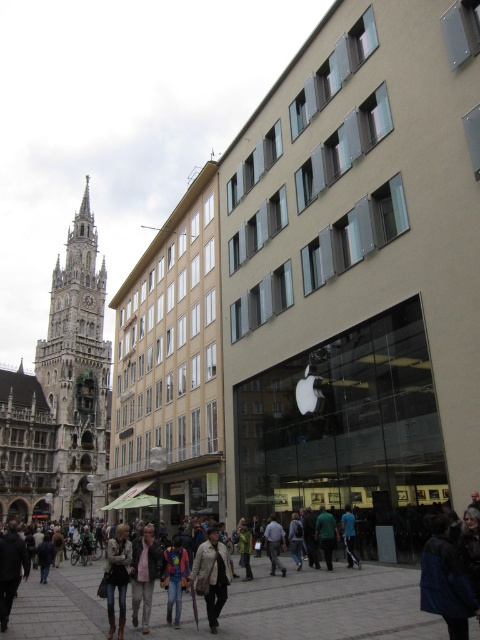
Question: Is light brown leather jacket at center wider than denim jacket at center?

Choices:
 (A) no
 (B) yes

Answer: (B)

Question: Among these objects, which one is farthest from the camera?

Choices:
 (A) light beige coat at center
 (B) dark blue jeans at center

Answer: (B)

Question: Considering the real-world distances, which object is closest to the light brown leather jacket at lower center?

Choices:
 (A) dark green jacket at center
 (B) dark blue jeans at center
 (C) golden stone tower at left

Answer: (A)

Question: Which of the following is the closest to the observer?

Choices:
 (A) (94, 273)
 (B) (352, 556)
 (C) (325, 556)

Answer: (B)

Question: Is light brown leather jacket at center to the left of denim jacket at lower left from the viewer's perspective?

Choices:
 (A) no
 (B) yes

Answer: (B)

Question: Does denim jacket at lower left come in front of dark green jacket at center?

Choices:
 (A) no
 (B) yes

Answer: (B)